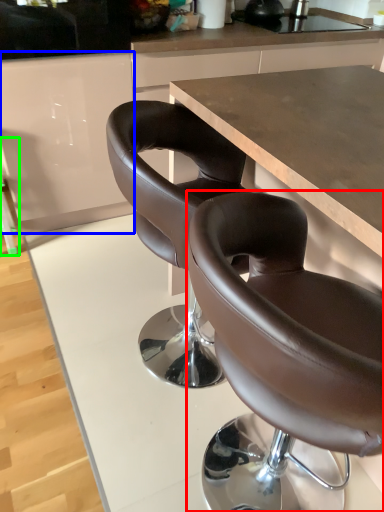
Question: Based on their relative distances, which object is farther from chair (highlighted by a red box)? Choose from cabinetry (highlighted by a blue box) and bar stool (highlighted by a green box).

Choices:
 (A) cabinetry
 (B) bar stool

Answer: (B)